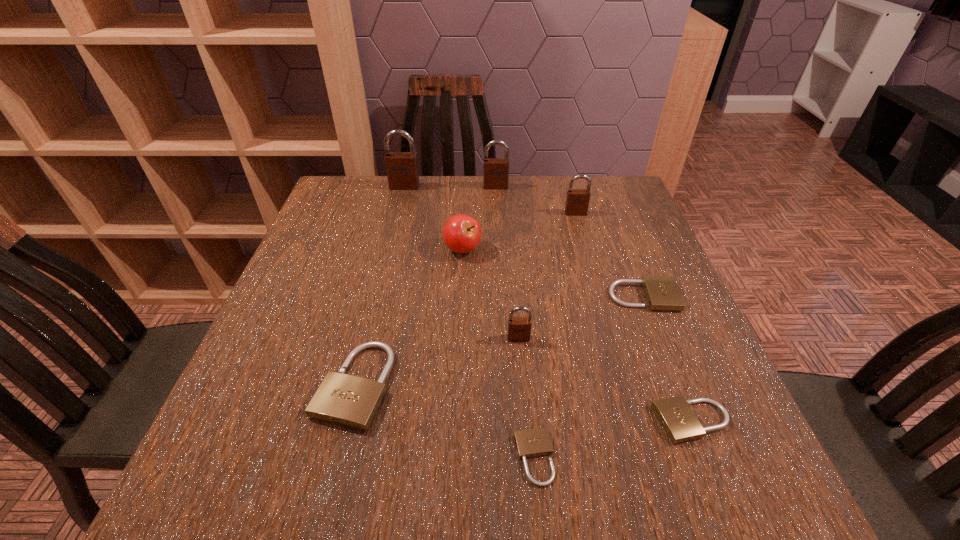
Find the location of a particular element. The image size is (960, 540). the leftmost brown padlock is located at coordinates (402, 167).

The height and width of the screenshot is (540, 960). Find the location of `the biggest brown padlock`. the biggest brown padlock is located at coordinates (402, 167).

At what (x,y) coordinates should I click in order to perform the action: click on the seventh shortest padlock. Please return your answer as a coordinate pair (x, y). The width and height of the screenshot is (960, 540). Looking at the image, I should click on (495, 170).

Locate an element on the screen. Image resolution: width=960 pixels, height=540 pixels. the second tallest object is located at coordinates (495, 170).

This screenshot has height=540, width=960. What are the coordinates of `the seventh shortest object` in the screenshot? It's located at (577, 201).

Image resolution: width=960 pixels, height=540 pixels. What are the coordinates of `the rightmost brown padlock` in the screenshot? It's located at (577, 201).

Image resolution: width=960 pixels, height=540 pixels. I want to click on the seventh object from right to left, so click(x=462, y=233).

Find the location of a particular element. The width and height of the screenshot is (960, 540). the fourth farthest object is located at coordinates (462, 233).

You are a GUI agent. You are given a task and a screenshot of the screen. Output one action in this format:
    pyautogui.click(x=<x>, y=<y>)
    Task: Click on the smallest brown padlock
    The height and width of the screenshot is (540, 960).
    Given the screenshot: What is the action you would take?
    pyautogui.click(x=519, y=328)

Locate an element on the screen. This screenshot has height=540, width=960. the sixth farthest object is located at coordinates (519, 328).